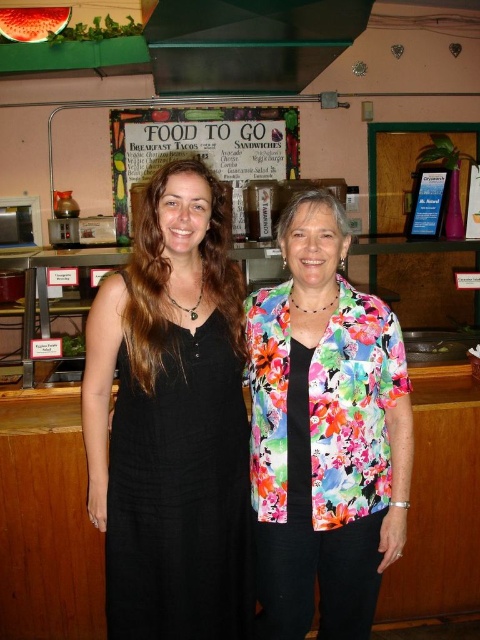
Looking at this image, you are a customer at the food counter and see the floral fabric blouse at center and the white paperboard at upper center. Which item is positioned to the right of the other?

The floral fabric blouse at center is to the right of the white paperboard at upper center.

Consider the image. You are standing in the dining area and want to move from the point at coordinates (137, 326) to the point at coordinates (255, 429). Which direction should you move?

You should move backward because point (137, 326) is in front of point (255, 429), so moving backward will take you towards the latter point.

You are a photographer standing at the entrance of the dining area. You want to take a photo of the floral fabric blouse at center. Is the blouse within your camera lens range of 5 feet?

The floral fabric blouse at center is 4.64 feet away from the camera, which is within the 5 feet range. Yes, it can be captured clearly.